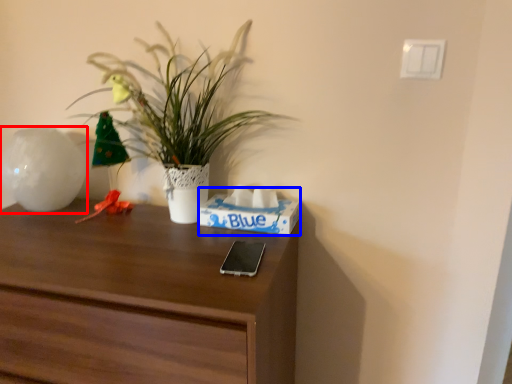
Question: Which object is further to the camera taking this photo, vase (highlighted by a red box) or shoe box (highlighted by a blue box)?

Choices:
 (A) vase
 (B) shoe box

Answer: (A)